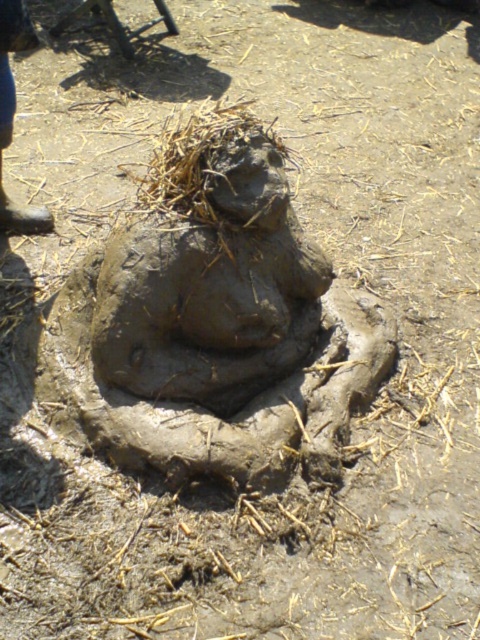
Between clay figure at center and blue jeans at left, which one has less height?

blue jeans at left

Does clay figure at center appear on the right side of blue jeans at left?

Correct, you'll find clay figure at center to the right of blue jeans at left.

Is point (191, 307) in front of point (0, 60)?

Yes, point (191, 307) is closer to viewer.

I want to click on clay figure at center, so click(216, 323).